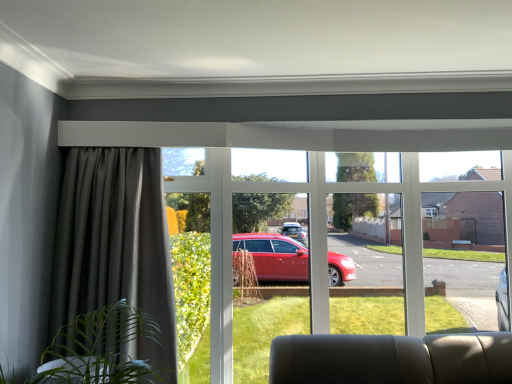
Question: Is dark grey textured curtain at left wider or thinner than clear glass window at center?

Choices:
 (A) thin
 (B) wide

Answer: (A)

Question: Does point (123, 284) appear closer or farther from the camera than point (315, 170)?

Choices:
 (A) closer
 (B) farther

Answer: (A)

Question: Based on their positions, is dark grey textured curtain at left located to the left or right of clear glass window at center?

Choices:
 (A) right
 (B) left

Answer: (B)

Question: Considering the positions of clear glass window at center and dark grey textured curtain at left in the image, is clear glass window at center wider or thinner than dark grey textured curtain at left?

Choices:
 (A) wide
 (B) thin

Answer: (A)

Question: Is clear glass window at center in front of or behind dark grey textured curtain at left in the image?

Choices:
 (A) front
 (B) behind

Answer: (B)

Question: Considering the positions of point (499, 187) and point (66, 286), is point (499, 187) closer or farther from the camera than point (66, 286)?

Choices:
 (A) farther
 (B) closer

Answer: (A)

Question: In terms of size, does clear glass window at center appear bigger or smaller than dark grey textured curtain at left?

Choices:
 (A) big
 (B) small

Answer: (A)